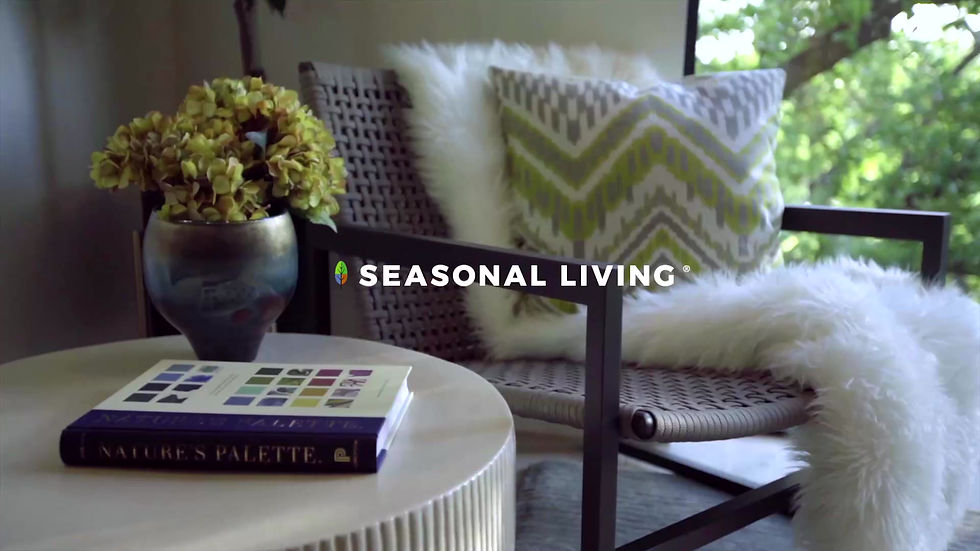
The height and width of the screenshot is (551, 980). In order to click on pillow in this screenshot , I will do `click(651, 217)`.